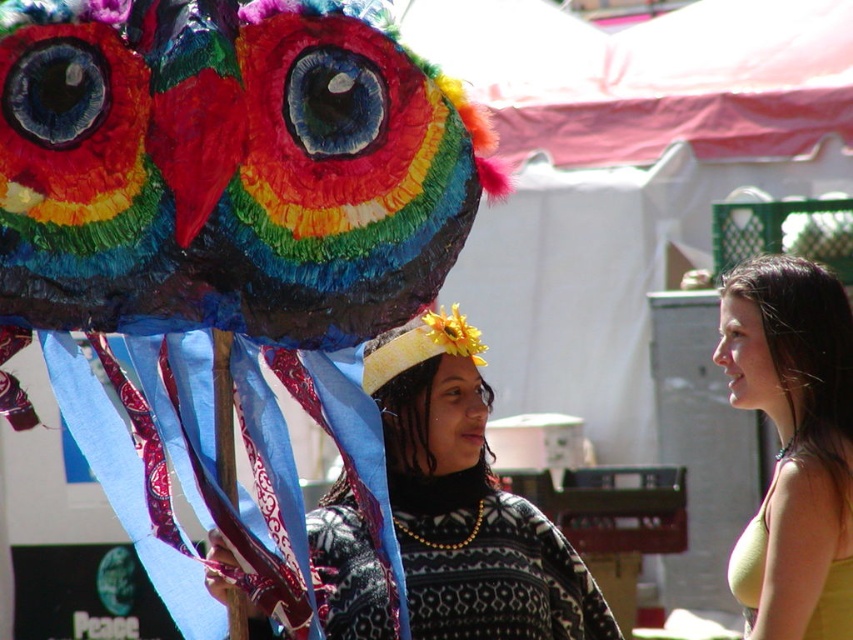
Between multicolored paper mache owl at left and yellow fabric top at center, which one has less height?

multicolored paper mache owl at left

Consider the image. Does multicolored paper mache owl at left have a lesser width compared to yellow fabric top at center?

No, multicolored paper mache owl at left is not thinner than yellow fabric top at center.

From the picture: Measure the distance between point (393, 120) and camera.

The distance of point (393, 120) from camera is 31.06 meters.

At what (x,y) coordinates should I click in order to perform the action: click on multicolored paper mache owl at left. Please return your answer as a coordinate pair (x, y). Looking at the image, I should click on (227, 168).

Between patterned sweater at center and yellow fabric top at center, which one is positioned lower?

patterned sweater at center

Does point (578, 636) lie in front of point (843, 444)?

Yes, point (578, 636) is in front of point (843, 444).

Where is `patterned sweater at center`? patterned sweater at center is located at coordinates (467, 502).

Does multicolored paper mache owl at left have a smaller size compared to patterned sweater at center?

Correct, multicolored paper mache owl at left occupies less space than patterned sweater at center.

Is multicolored paper mache owl at left above patterned sweater at center?

Correct, multicolored paper mache owl at left is located above patterned sweater at center.

Is point (299, 172) behind point (451, 417)?

No.

Locate an element on the screen. The height and width of the screenshot is (640, 853). multicolored paper mache owl at left is located at coordinates (227, 168).